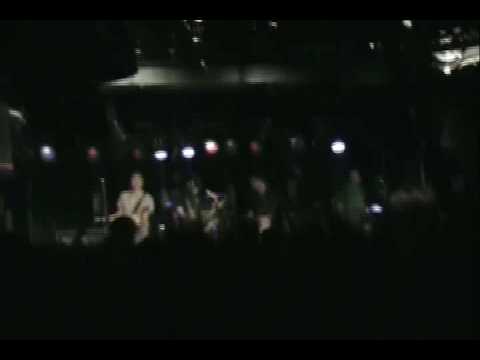
What are the coordinates of `floor` in the screenshot? It's located at (212, 300).